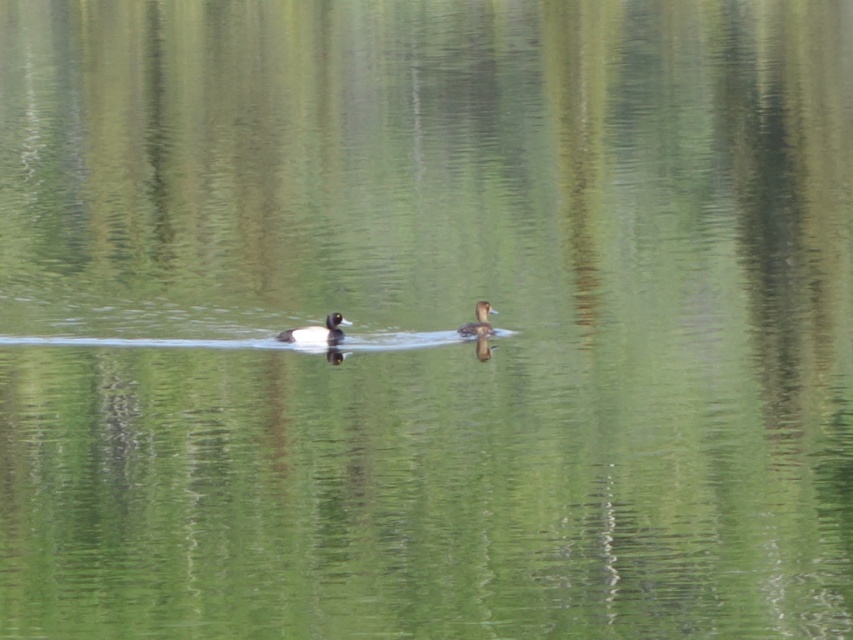
You are a photographer aiming to capture a closeup of the brown matte duck at center in the image. Given that your camera has a focal length of 100mm and you are currently positioned 5 meters away from the point marked at coordinates point (x=316, y=332), will you be able to fill the frame with the duck without moving closer?

The point (x=316, y=332) marks the brown matte duck at center, so at 5 meters away with a 100mm lens, the field of view would allow the duck to fill the frame adequately without needing to move closer.

You are observing two ducks swimming in the center of a lake. The ducks are positioned centrally in the frame. Which duck is positioned lower in the image, the brown matte duck at center or the brown fuzzy duck at center?

The brown matte duck at center is positioned lower than the brown fuzzy duck at center in the image.